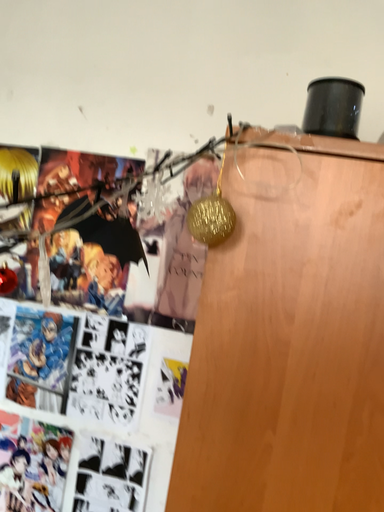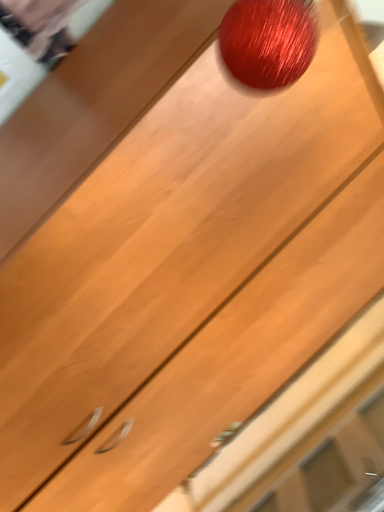
Question: How did the camera likely rotate when shooting the video?

Choices:
 (A) rotated right
 (B) rotated left

Answer: (A)